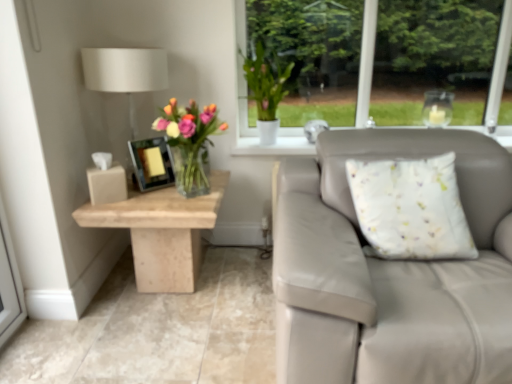
Question: Does white fabric cushion at right have a smaller size compared to translucent glass vase at center?

Choices:
 (A) yes
 (B) no

Answer: (B)

Question: From the image's perspective, is white fabric cushion at right below translucent glass vase at center?

Choices:
 (A) yes
 (B) no

Answer: (A)

Question: Is white fabric cushion at right to the right of translucent glass vase at center from the viewer's perspective?

Choices:
 (A) yes
 (B) no

Answer: (A)

Question: Considering the relative positions of white fabric cushion at right and translucent glass vase at center in the image provided, is white fabric cushion at right to the left of translucent glass vase at center from the viewer's perspective?

Choices:
 (A) no
 (B) yes

Answer: (A)

Question: From the image's perspective, is white fabric cushion at right on top of translucent glass vase at center?

Choices:
 (A) yes
 (B) no

Answer: (B)

Question: From a real-world perspective, relative to beige marble table at left, is white matte vase at upper center vertically above or below?

Choices:
 (A) below
 (B) above

Answer: (B)

Question: Looking at their shapes, would you say white matte vase at upper center is wider or thinner than beige marble table at left?

Choices:
 (A) thin
 (B) wide

Answer: (A)

Question: Relative to beige marble table at left, is white matte vase at upper center in front or behind?

Choices:
 (A) behind
 (B) front

Answer: (A)

Question: Considering the positions of white matte vase at upper center and beige marble table at left in the image, is white matte vase at upper center bigger or smaller than beige marble table at left?

Choices:
 (A) small
 (B) big

Answer: (A)

Question: Is matte black picture frame at center situated inside translucent glass vase at center or outside?

Choices:
 (A) inside
 (B) outside

Answer: (B)

Question: Is point (169, 183) closer or farther from the camera than point (194, 175)?

Choices:
 (A) farther
 (B) closer

Answer: (A)

Question: Looking at their shapes, would you say matte black picture frame at center is wider or thinner than translucent glass vase at center?

Choices:
 (A) wide
 (B) thin

Answer: (B)

Question: From a real-world perspective, is matte black picture frame at center physically located above or below translucent glass vase at center?

Choices:
 (A) below
 (B) above

Answer: (A)

Question: Based on their sizes in the image, would you say white fabric lampshade at upper left is bigger or smaller than white matte vase at upper center?

Choices:
 (A) small
 (B) big

Answer: (B)

Question: Visually, is white fabric lampshade at upper left positioned to the left or to the right of white matte vase at upper center?

Choices:
 (A) left
 (B) right

Answer: (A)